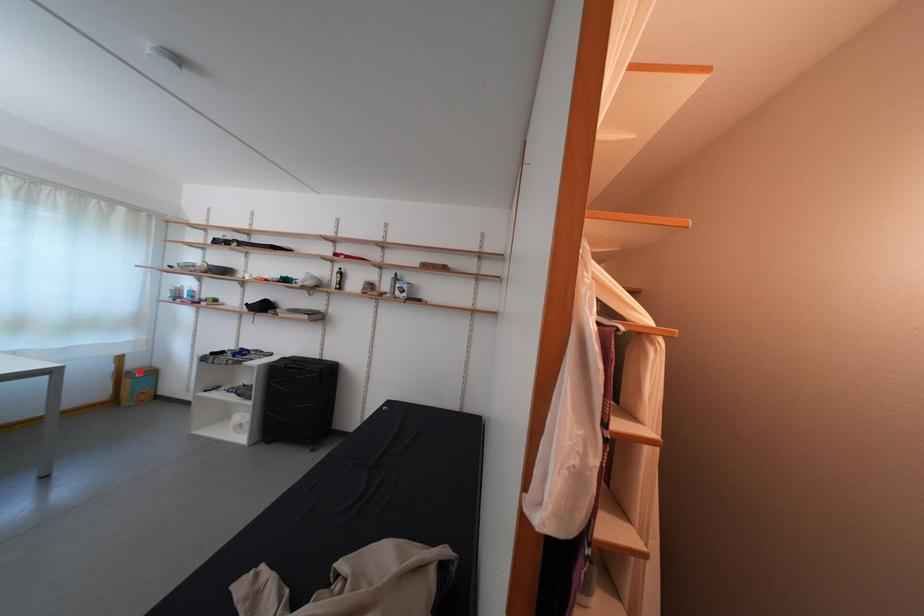
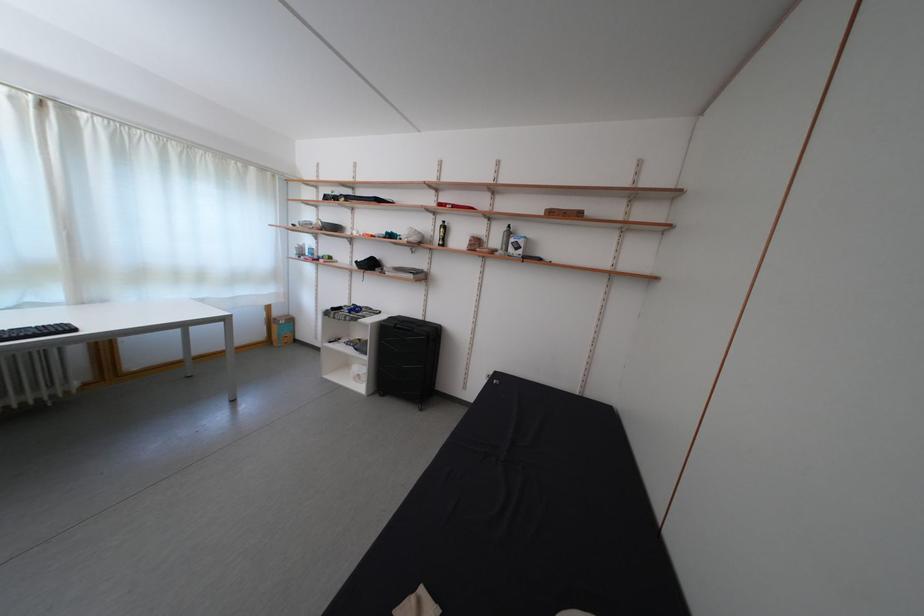
Where in the second image is the point corresponding to the highlighted location from the first image?

(285, 320)